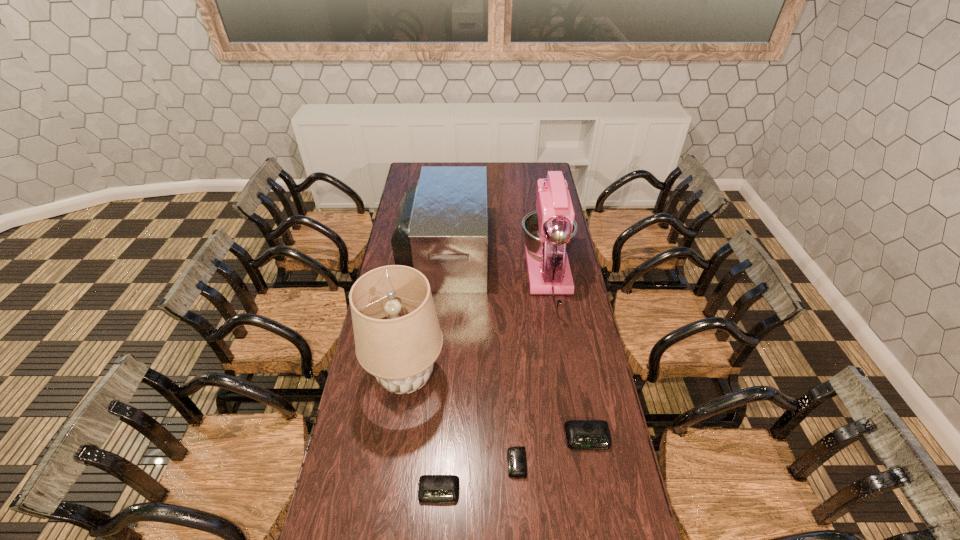
You are a GUI agent. You are given a task and a screenshot of the screen. Output one action in this format:
    pyautogui.click(x=<x>, y=<y>)
    Task: Click on the blank space that satisfies the following two spatial constraints: 1. on the face of the mixer; 2. on the front-facing side of the fourth shortest object
    
    Given the screenshot: What is the action you would take?
    pyautogui.click(x=544, y=252)

Where is `blank area in the image that satisfies the following two spatial constraints: 1. on the face of the mixer; 2. on the front-facing side of the microwave oven`? blank area in the image that satisfies the following two spatial constraints: 1. on the face of the mixer; 2. on the front-facing side of the microwave oven is located at coordinates (544, 252).

Where is `vacant region that satisfies the following two spatial constraints: 1. on the display of the tallest alarm clock; 2. on the display of the second alarm clock from right to left`? The width and height of the screenshot is (960, 540). vacant region that satisfies the following two spatial constraints: 1. on the display of the tallest alarm clock; 2. on the display of the second alarm clock from right to left is located at coordinates (592, 463).

Locate an element on the screen. This screenshot has height=540, width=960. vacant region that satisfies the following two spatial constraints: 1. on the display of the tallest alarm clock; 2. on the display of the shortest alarm clock is located at coordinates (592, 463).

You are a GUI agent. You are given a task and a screenshot of the screen. Output one action in this format:
    pyautogui.click(x=<x>, y=<y>)
    Task: Click on the vacant space that satisfies the following two spatial constraints: 1. on the display of the rightmost alarm clock; 2. on the display of the second alarm clock from left to right
    The image size is (960, 540).
    Given the screenshot: What is the action you would take?
    pyautogui.click(x=592, y=463)